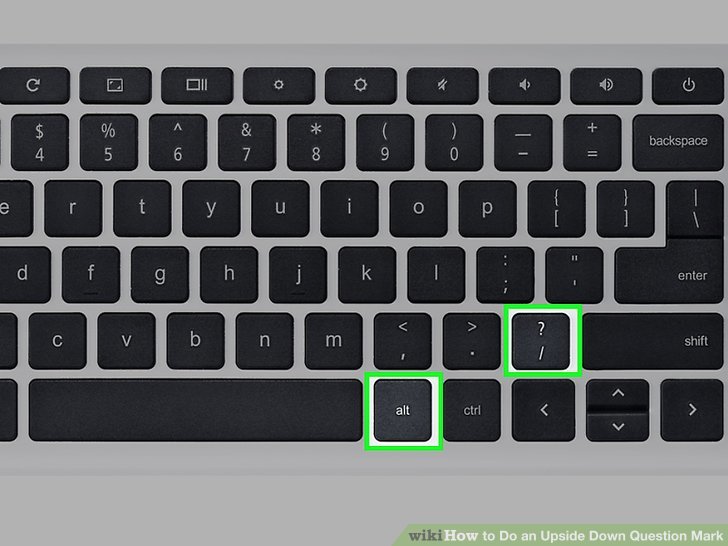
Image resolution: width=728 pixels, height=546 pixels. I want to click on number keys on keyboard, so click(58, 158), click(124, 159), click(194, 159), click(263, 159), click(336, 161), click(403, 159), click(472, 160).